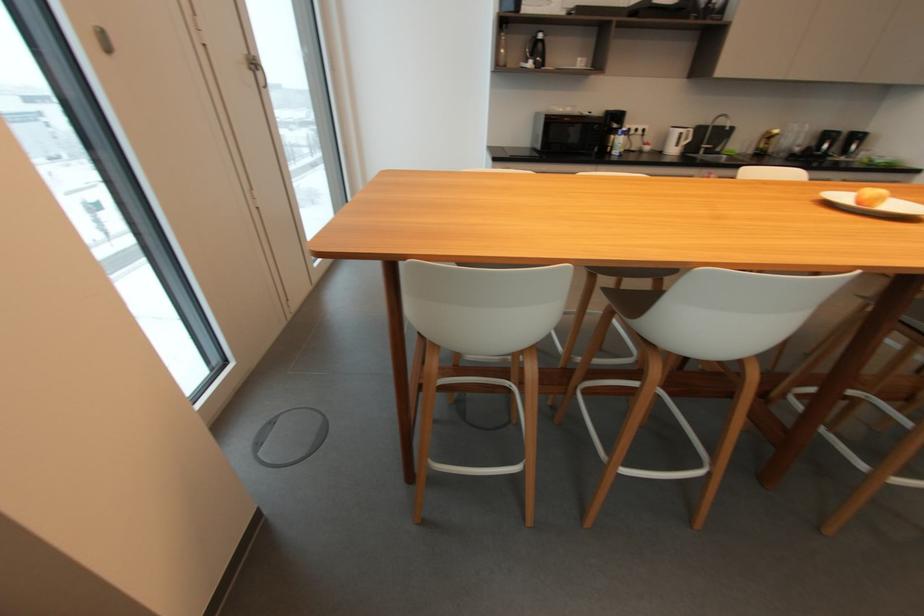
Where is `microwave door handle`? Image resolution: width=924 pixels, height=616 pixels. microwave door handle is located at coordinates (602, 144).